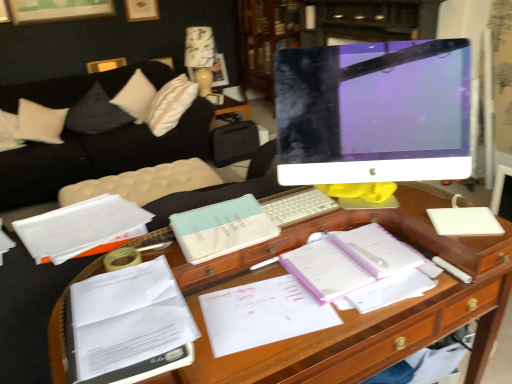
Question: From a real-world perspective, is white paper at left, the first book from the back, located higher than white glossy computer monitor at center?

Choices:
 (A) no
 (B) yes

Answer: (A)

Question: From the image's perspective, would you say white paper at left, which appears as the 3th book when viewed from the front, is positioned over white glossy computer monitor at center?

Choices:
 (A) yes
 (B) no

Answer: (B)

Question: Is white paper at left, which appears as the 3th book when viewed from the front, shorter than white glossy computer monitor at center?

Choices:
 (A) yes
 (B) no

Answer: (A)

Question: Is white paper at left, the first book from the back, positioned with its back to white glossy computer monitor at center?

Choices:
 (A) yes
 (B) no

Answer: (B)

Question: Considering the relative sizes of white paper at left, which appears as the 3th book when viewed from the front, and white glossy computer monitor at center in the image provided, is white paper at left, which appears as the 3th book when viewed from the front, smaller than white glossy computer monitor at center?

Choices:
 (A) yes
 (B) no

Answer: (A)

Question: Would you say white soft pillow at upper left, placed as the first pillow when sorted from right to left, is inside or outside purple spiral notebook at center?

Choices:
 (A) inside
 (B) outside

Answer: (B)

Question: Relative to purple spiral notebook at center, is white soft pillow at upper left, placed as the first pillow when sorted from right to left, in front or behind?

Choices:
 (A) front
 (B) behind

Answer: (B)

Question: Considering the relative positions of white soft pillow at upper left, placed as the first pillow when sorted from right to left, and purple spiral notebook at center in the image provided, is white soft pillow at upper left, placed as the first pillow when sorted from right to left, to the left or to the right of purple spiral notebook at center?

Choices:
 (A) right
 (B) left

Answer: (B)

Question: Considering the positions of point (132, 74) and point (316, 243), is point (132, 74) closer or farther from the camera than point (316, 243)?

Choices:
 (A) farther
 (B) closer

Answer: (A)

Question: Considering the positions of purple spiral notebook at center and white plastic keyboard at center in the image, is purple spiral notebook at center wider or thinner than white plastic keyboard at center?

Choices:
 (A) wide
 (B) thin

Answer: (A)

Question: In the image, is purple spiral notebook at center on the left side or the right side of white plastic keyboard at center?

Choices:
 (A) right
 (B) left

Answer: (A)

Question: Considering the positions of point (325, 261) and point (272, 216), is point (325, 261) closer or farther from the camera than point (272, 216)?

Choices:
 (A) closer
 (B) farther

Answer: (A)

Question: From their relative heights in the image, would you say purple spiral notebook at center is taller or shorter than white plastic keyboard at center?

Choices:
 (A) tall
 (B) short

Answer: (A)

Question: Is point (282, 46) positioned closer to the camera than point (110, 334)?

Choices:
 (A) farther
 (B) closer

Answer: (A)

Question: In terms of height, does wooden bookshelf at upper center look taller or shorter compared to white paper at lower left, which is counted as the first book, starting from the front?

Choices:
 (A) short
 (B) tall

Answer: (B)